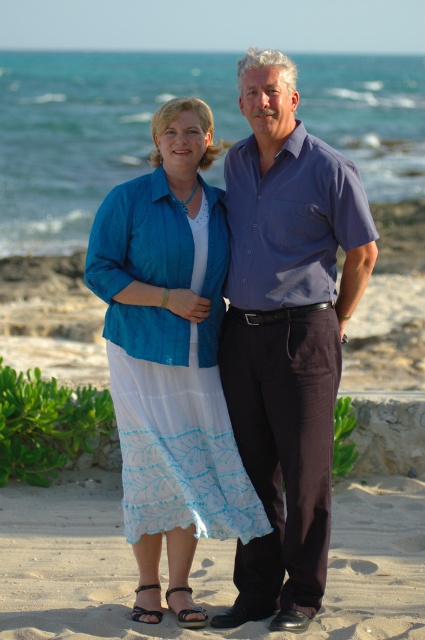
You are a photographer trying to capture a closeup shot of the matte blue blouse at center and the sandy at lower center. Which object should you zoom in more on to ensure both are in focus?

The matte blue blouse at center has a smaller size compared to sandy at lower center, so you should zoom in more on the matte blue blouse at center to ensure both are in focus.

You are a photographer trying to capture a closeup of the matte blue blouse at center while avoiding the sandy at lower center from entering the frame. Based on their positions, which direction should you move your camera to the left or right?

The matte blue blouse at center is to the left of sandy at lower center. To avoid including the sandy at lower center in the frame, you should move your camera to the right so that the matte blue blouse at center remains centered while shifting away from the sandy area.